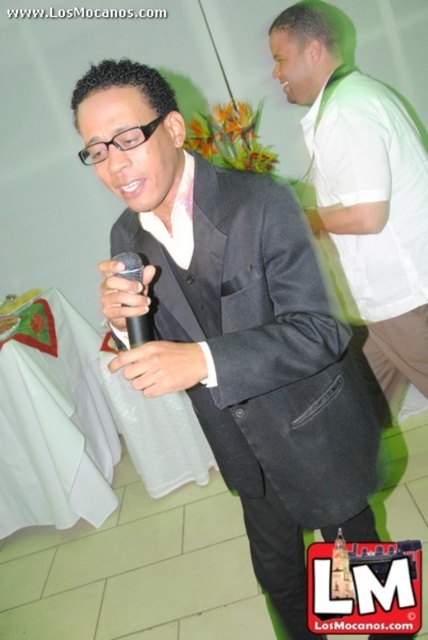
Consider the image. Who is lower down, white matte shirt at upper right or black matte microphone at center?

Positioned lower is black matte microphone at center.

This screenshot has height=640, width=428. In order to click on white matte shirt at upper right in this screenshot , I will do `click(363, 192)`.

Is point (232, 464) less distant than point (326, 84)?

Yes, it is.

Describe the element at coordinates (234, 326) in the screenshot. I see `matte black suit at center` at that location.

Where is `matte black suit at center`? matte black suit at center is located at coordinates (234, 326).

Image resolution: width=428 pixels, height=640 pixels. I want to click on matte black suit at center, so click(x=234, y=326).

Does matte black suit at center have a greater height compared to black matte microphone at center?

Yes, matte black suit at center is taller than black matte microphone at center.

Is matte black suit at center above black matte microphone at center?

Incorrect, matte black suit at center is not positioned above black matte microphone at center.

Is point (222, 262) farther from camera compared to point (128, 339)?

Yes, point (222, 262) is farther from viewer.

This screenshot has height=640, width=428. What are the coordinates of `matte black suit at center` in the screenshot? It's located at (234, 326).